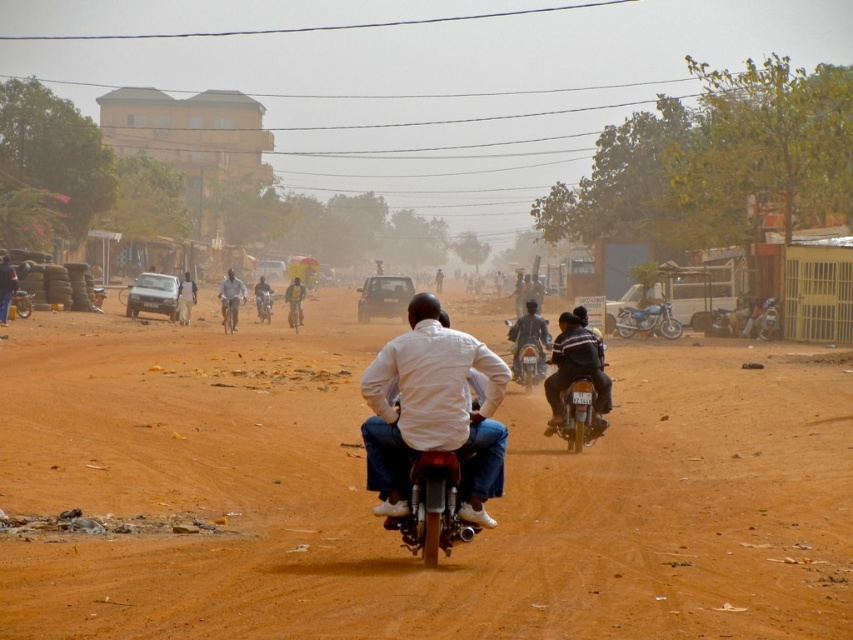
Question: Estimate the real-world distances between objects in this image. Which object is farther from the brown sandy ground at center?

Choices:
 (A) light gray metallic motorcycle at center
 (B) metallic blue motorcycle at center
 (C) striped fabric motorcycle at center
 (D) dark gray motorcycle at center

Answer: (A)

Question: Can you confirm if dark gray motorcycle at center is wider than dark blue jeans at center?

Choices:
 (A) no
 (B) yes

Answer: (A)

Question: Estimate the real-world distances between objects in this image. Which object is closer to the metallic blue motorcycle at center?

Choices:
 (A) shiny chrome motorcycle at center
 (B) white matte shirt at center
 (C) light gray metallic motorcycle at center

Answer: (C)

Question: Is striped fabric motorcycle at center bigger than dark blue jeans at center?

Choices:
 (A) yes
 (B) no

Answer: (B)

Question: Is white matte shirt at center to the left of light brown leather jacket at center from the viewer's perspective?

Choices:
 (A) yes
 (B) no

Answer: (B)

Question: Considering the real-world distances, which object is farthest from the dark gray motorcycle at center?

Choices:
 (A) striped fabric motorcycle at center
 (B) shiny chrome motorcycle at center
 (C) dark blue jeans at center

Answer: (C)